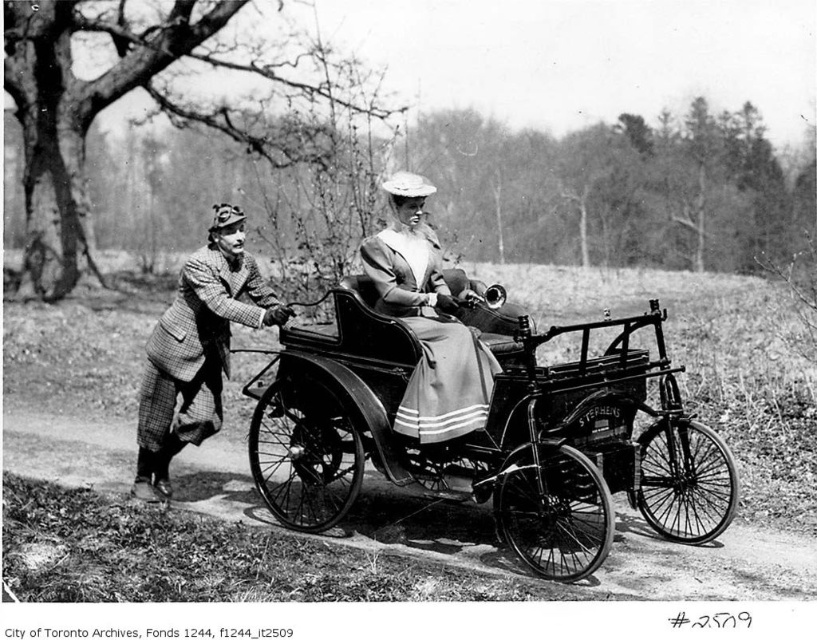
Can you confirm if metallic black wagon at center is thinner than plaid wool coat at left?

No, metallic black wagon at center is not thinner than plaid wool coat at left.

Between point (597, 488) and point (155, 497), which one is positioned behind?

Point (155, 497)

Image resolution: width=817 pixels, height=640 pixels. I want to click on metallic black wagon at center, so click(490, 436).

Between metallic black wagon at center and matte gray coat at center, which one is positioned lower?

Positioned lower is metallic black wagon at center.

Is metallic black wagon at center wider than matte gray coat at center?

Yes, metallic black wagon at center is wider than matte gray coat at center.

At what (x,y) coordinates should I click in order to perform the action: click on metallic black wagon at center. Please return your answer as a coordinate pair (x, y). Looking at the image, I should click on (490, 436).

What are the coordinates of `metallic black wagon at center` in the screenshot? It's located at (490, 436).

Is plaid wool coat at left shorter than matte gray coat at center?

In fact, plaid wool coat at left may be taller than matte gray coat at center.

Does plaid wool coat at left have a larger size compared to matte gray coat at center?

Correct, plaid wool coat at left is larger in size than matte gray coat at center.

Find the location of a particular element. Image resolution: width=817 pixels, height=640 pixels. plaid wool coat at left is located at coordinates (197, 348).